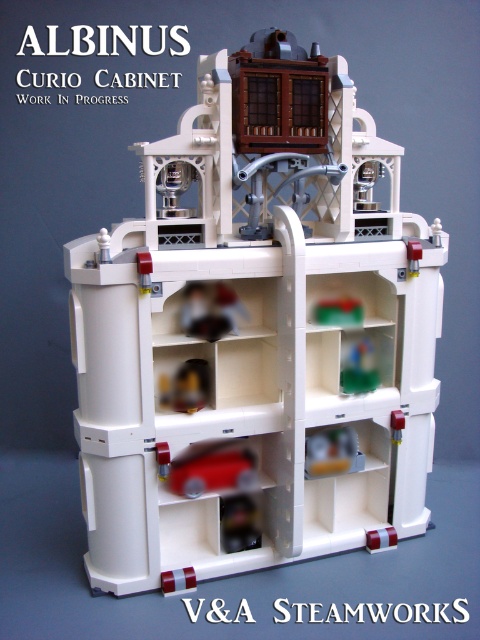
What is located at the point with coordinates [214,467] in the LEGO cabinet model?

The point at coordinates [214,467] is where the matte red car at center is located.

You are trying to place the matte plastic toy car at lower center into a storage container that can only accommodate items narrower than the translucent green glass at center. Based on the scene description, will the toy car fit?

The matte plastic toy car at lower center is wider than the translucent green glass at center, so it will not fit in the storage container designed for items narrower than the translucent green glass at center.